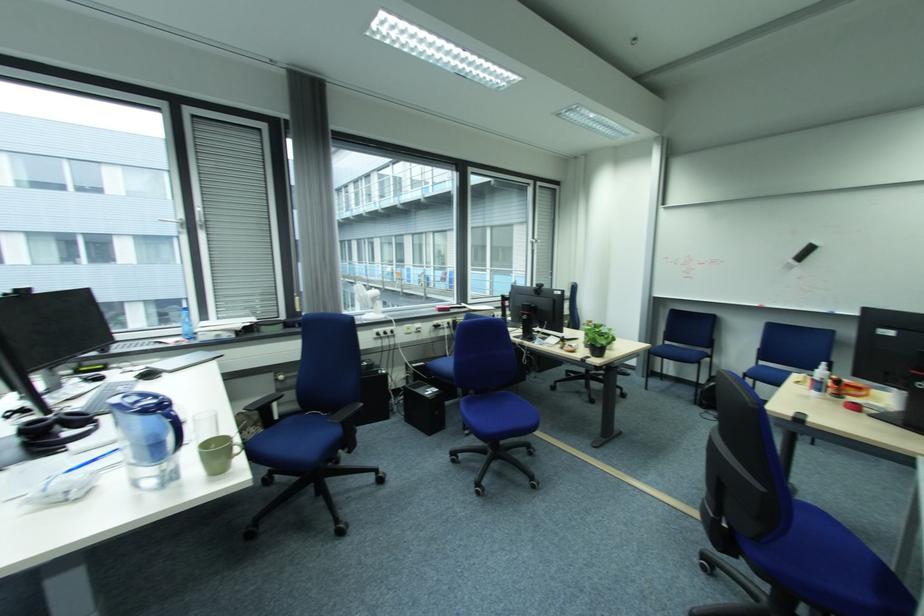
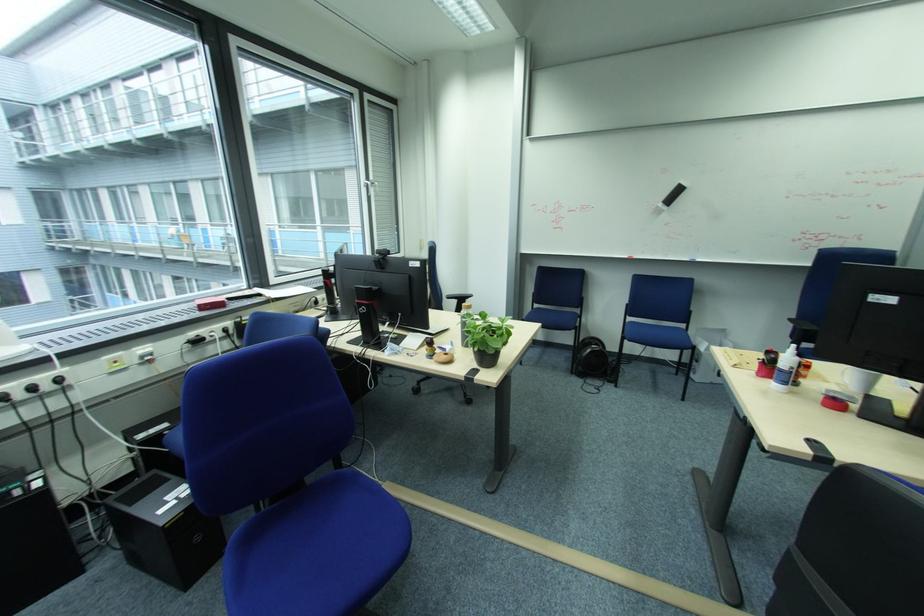
Locate, in the second image, the point that corresponds to [752,376] in the first image.

(633, 339)